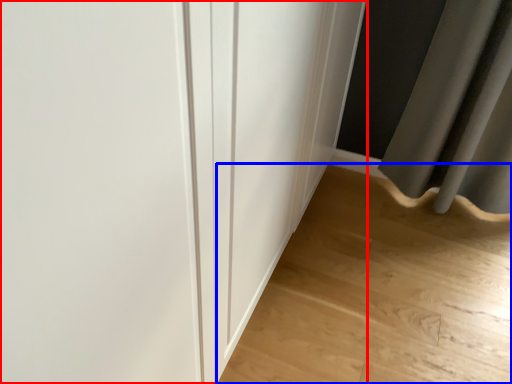
Question: Which object appears closest to the camera in this image, door (highlighted by a red box) or corridor (highlighted by a blue box)?

Choices:
 (A) door
 (B) corridor

Answer: (A)